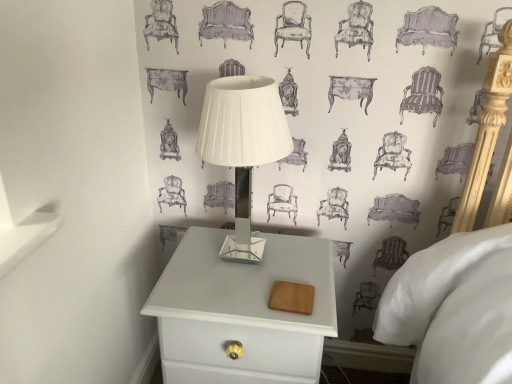
Where is `spots to the right of white glossy table lamp at center`? The height and width of the screenshot is (384, 512). spots to the right of white glossy table lamp at center is located at coordinates (309, 263).